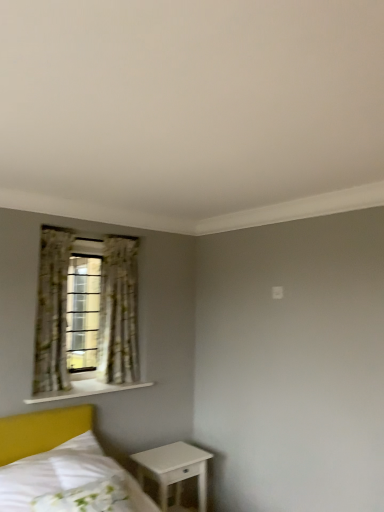
The width and height of the screenshot is (384, 512). Find the location of `empty space that is ontop of floral fabric curtain at left, the first curtain viewed from the right (from a real-world perspective)`. empty space that is ontop of floral fabric curtain at left, the first curtain viewed from the right (from a real-world perspective) is located at coordinates (126, 236).